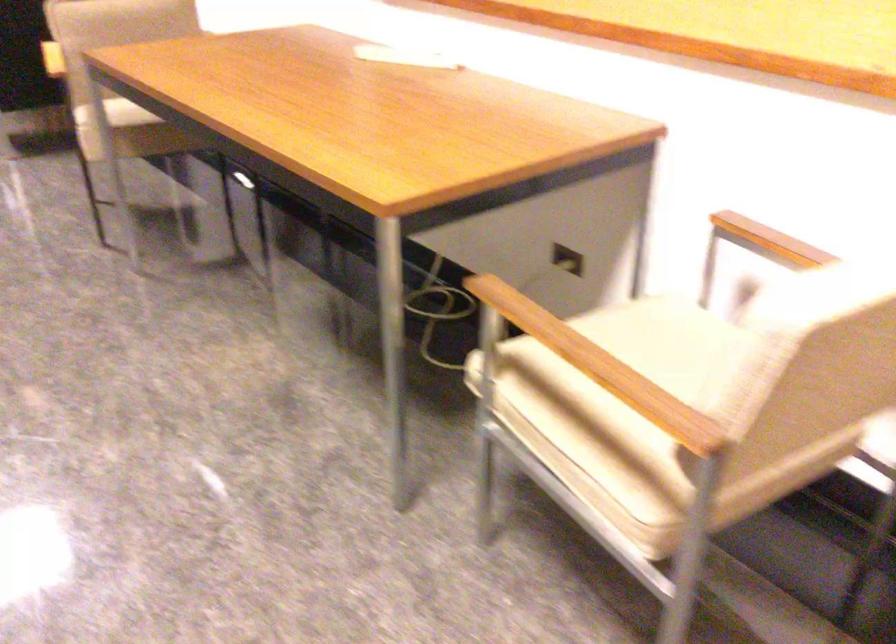
Locate an element on the screen. This screenshot has width=896, height=644. recessed drawer handle is located at coordinates (236, 176).